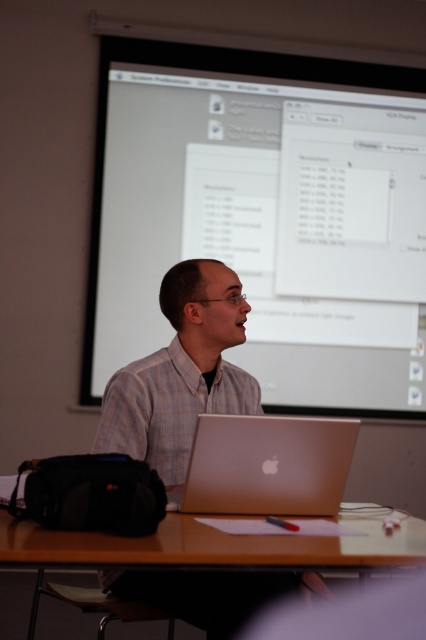
Question: Which of these objects is positioned farthest from the brown wooden table at center?

Choices:
 (A) satin gold laptop at center
 (B) white glossy projection screen at upper center

Answer: (B)

Question: Does white glossy projection screen at upper center appear on the right side of plaid shirt at center?

Choices:
 (A) yes
 (B) no

Answer: (A)

Question: Can you confirm if brown wooden table at center is positioned to the left of satin gold laptop at center?

Choices:
 (A) yes
 (B) no

Answer: (A)

Question: Can you confirm if white glossy projection screen at upper center is positioned below plaid shirt at center?

Choices:
 (A) yes
 (B) no

Answer: (B)

Question: Estimate the real-world distances between objects in this image. Which object is closer to the plaid shirt at center?

Choices:
 (A) satin gold laptop at center
 (B) brown wooden table at center
 (C) white glossy projection screen at upper center

Answer: (A)

Question: Which object appears closest to the camera in this image?

Choices:
 (A) plaid shirt at center
 (B) brown wooden table at center

Answer: (B)